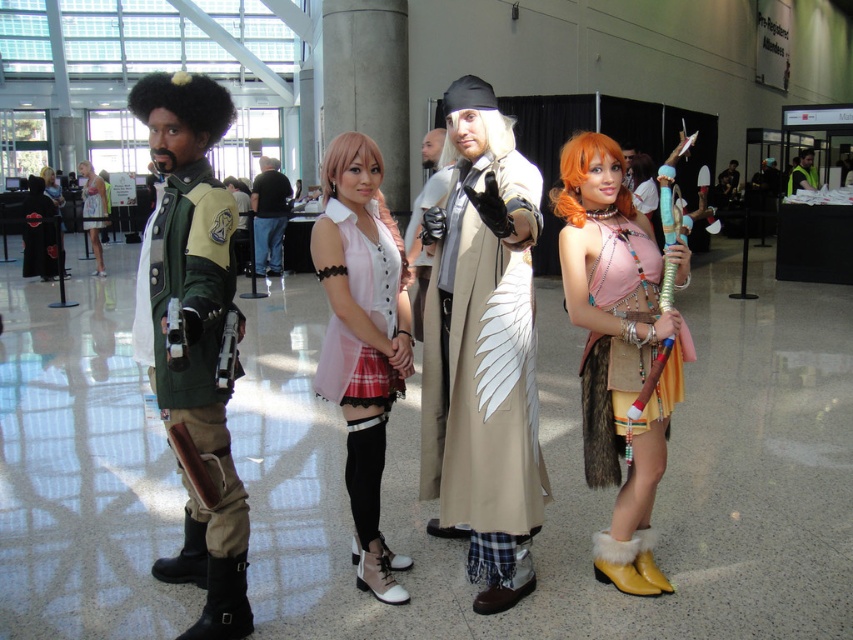
Looking at this image, can you confirm if matte black jacket at center is taller than matte pink dress at center?

No, matte black jacket at center is not taller than matte pink dress at center.

Is matte black jacket at center further to camera compared to matte pink dress at center?

That is True.

This screenshot has width=853, height=640. Describe the element at coordinates (93, 211) in the screenshot. I see `matte black jacket at center` at that location.

Locate an element on the screen. The width and height of the screenshot is (853, 640). matte black jacket at center is located at coordinates (93, 211).

Is point (375, 232) closer to viewer compared to point (24, 244)?

Yes, it is in front of point (24, 244).

Can you confirm if pink fabric dress at center is taller than black leather jacket at center?

Correct, pink fabric dress at center is much taller as black leather jacket at center.

Between point (358, 349) and point (48, 244), which one is positioned in front?

Point (358, 349)

At what (x,y) coordinates should I click in order to perform the action: click on pink fabric dress at center. Please return your answer as a coordinate pair (x, y). The image size is (853, 640). Looking at the image, I should click on (363, 339).

Can you confirm if leather fringe skirt at center is positioned below matte pink dress at center?

Correct, leather fringe skirt at center is located below matte pink dress at center.

Does point (598, 243) lie in front of point (42, 170)?

Yes.

Which is behind, point (596, 429) or point (61, 195)?

The point (61, 195) is behind.

Locate an element on the screen. The image size is (853, 640). leather fringe skirt at center is located at coordinates (618, 348).